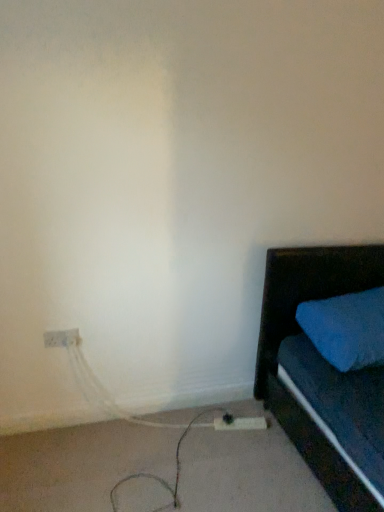
The height and width of the screenshot is (512, 384). Identify the location of free space to the right of white plastic extension cord at lower center. (264, 425).